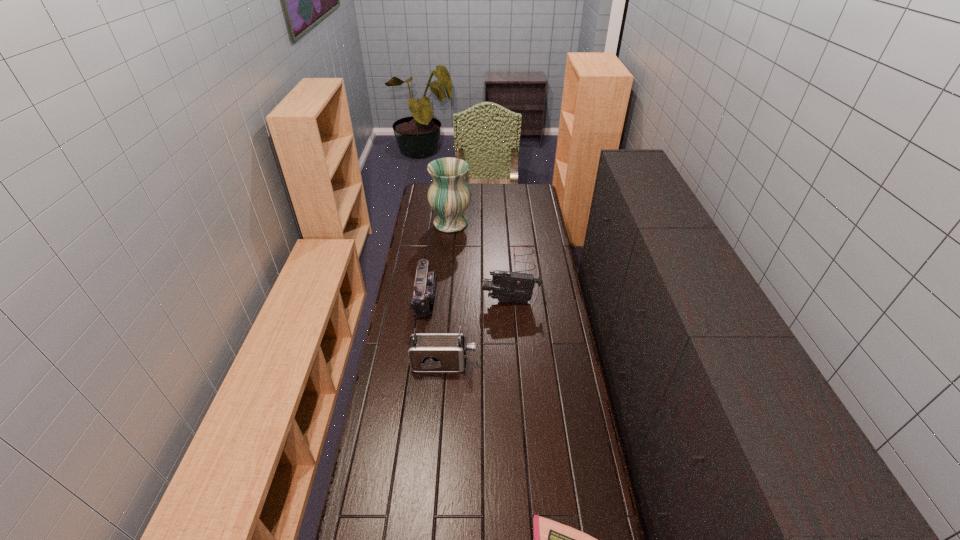
Where is `vacant space located on the front-facing side of the rightmost camcorder`? This screenshot has height=540, width=960. vacant space located on the front-facing side of the rightmost camcorder is located at coordinates (420, 301).

The height and width of the screenshot is (540, 960). I want to click on free space located on the front-facing side of the rightmost camcorder, so click(438, 301).

I want to click on vacant space situated 0.320m on the front-facing side of the shortest camcorder, so click(506, 298).

In order to click on blank space located on the face of the spectacles in this screenshot , I will do `click(494, 259)`.

Identify the location of vacant region located on the face of the spectacles. (476, 259).

This screenshot has height=540, width=960. In order to click on vacant area situated 0.160m on the face of the spectacles in this screenshot , I will do `click(482, 259)`.

Where is `vase positioned at the left edge`? This screenshot has height=540, width=960. vase positioned at the left edge is located at coordinates (x=449, y=196).

This screenshot has width=960, height=540. In order to click on camcorder present at the right edge in this screenshot , I will do `click(506, 286)`.

Identify the location of spectacles that is at the right edge. (515, 246).

The height and width of the screenshot is (540, 960). Find the location of `free location at the far edge`. free location at the far edge is located at coordinates (500, 195).